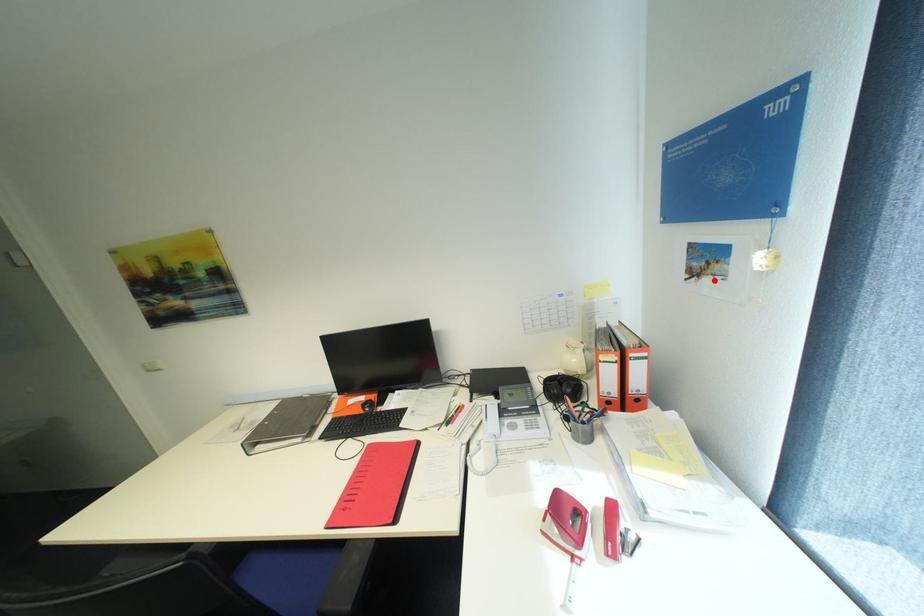
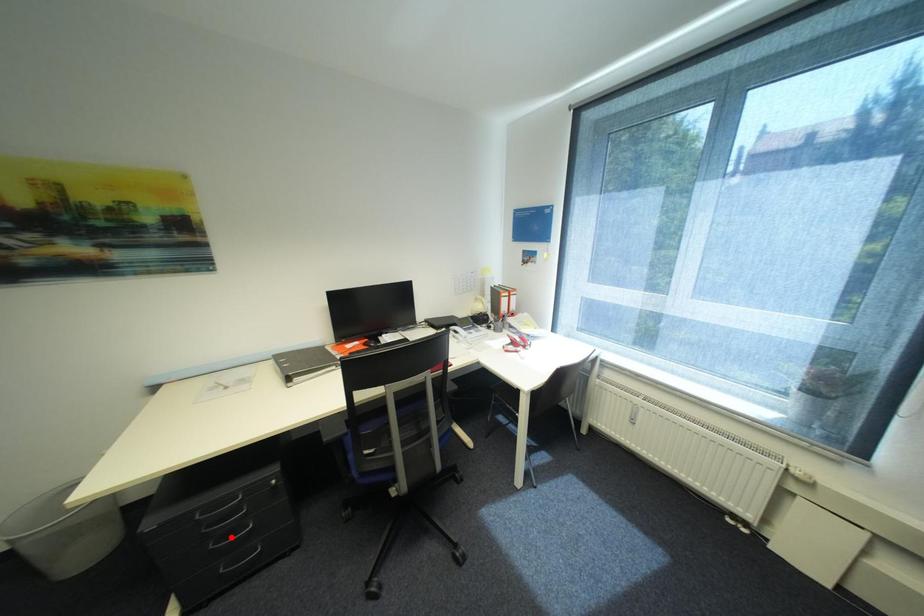
I am providing you with two images of the same scene from different viewpoints. A red point is marked on the first image and another point is marked on the second image. Are the points marked in image1 and image2 representing the same 3D position?

No